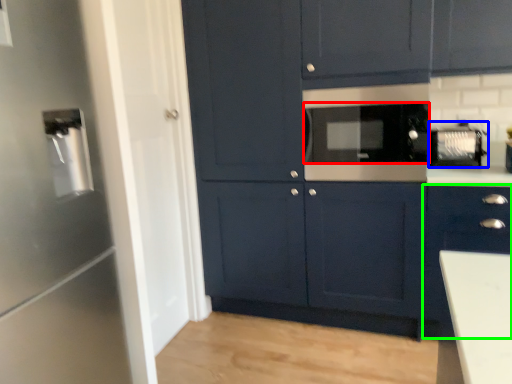
Question: Which object is positioned farthest from appliance (highlighted by a red box)? Select from appliance (highlighted by a blue box) and cabinetry (highlighted by a green box).

Choices:
 (A) appliance
 (B) cabinetry

Answer: (B)